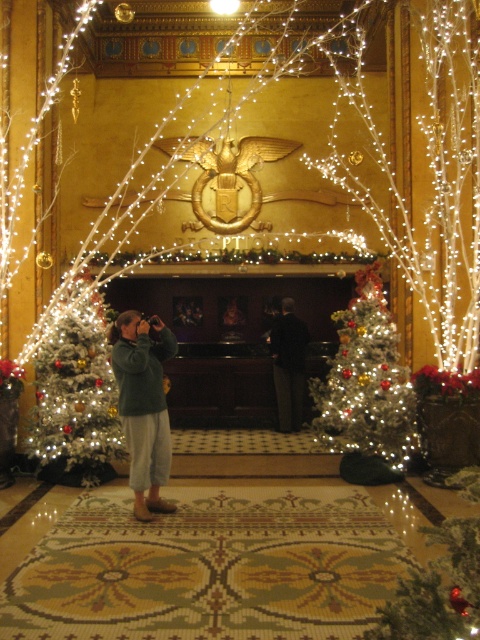
Between point (362, 392) and point (283, 417), which one is positioned in front?

Point (362, 392) is more forward.

Which of these two, white frosted christmas tree at center or dark brown suit at center, stands shorter?

Standing shorter between the two is dark brown suit at center.

Where is `white frosted christmas tree at center`? white frosted christmas tree at center is located at coordinates (367, 381).

From the picture: Between white frosted christmas tree at center and green fleece jacket at center, which one is positioned higher?

Positioned higher is white frosted christmas tree at center.

Identify the location of white frosted christmas tree at center. (367, 381).

Where is `white frosted christmas tree at left`? white frosted christmas tree at left is located at coordinates (75, 400).

Can you confirm if white frosted christmas tree at left is wider than white frosted christmas tree at center?

In fact, white frosted christmas tree at left might be narrower than white frosted christmas tree at center.

Where is `white frosted christmas tree at left`? white frosted christmas tree at left is located at coordinates (75, 400).